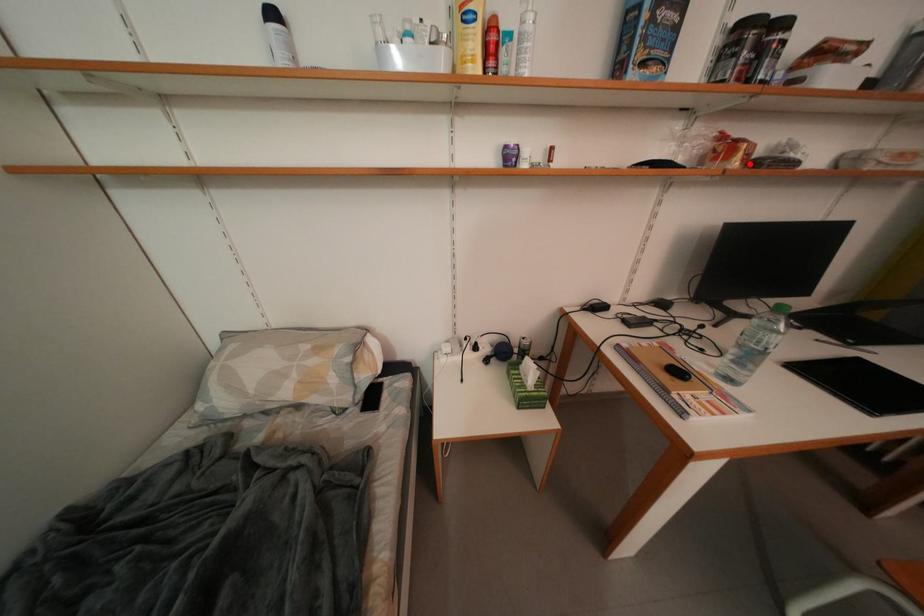
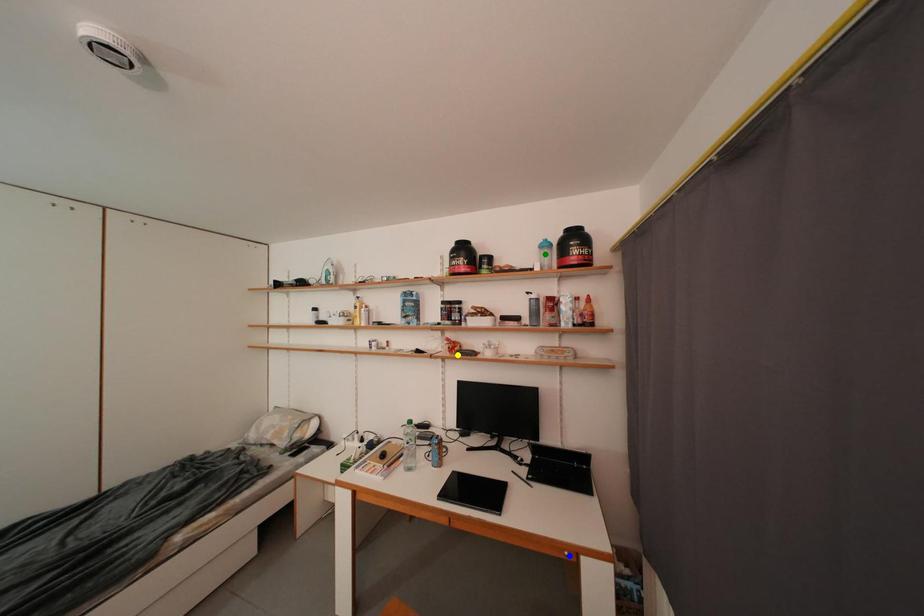
Question: I am providing you with two images of the same scene from different viewpoints. A red point is marked on the first image. You are given multiple points on the second image. Which spot in image 2 lines up with the point in image 1?

Choices:
 (A) blue point
 (B) yellow point
 (C) green point

Answer: (B)